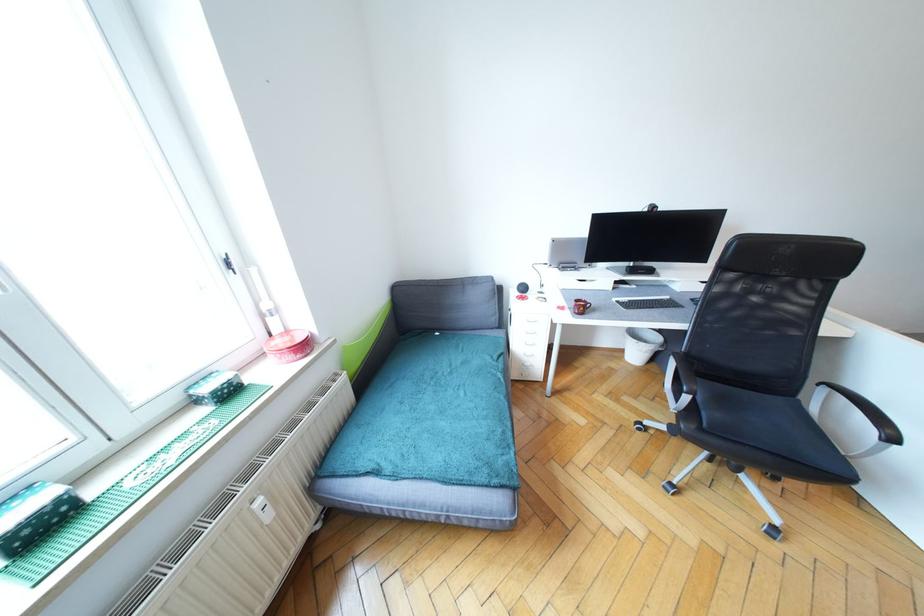
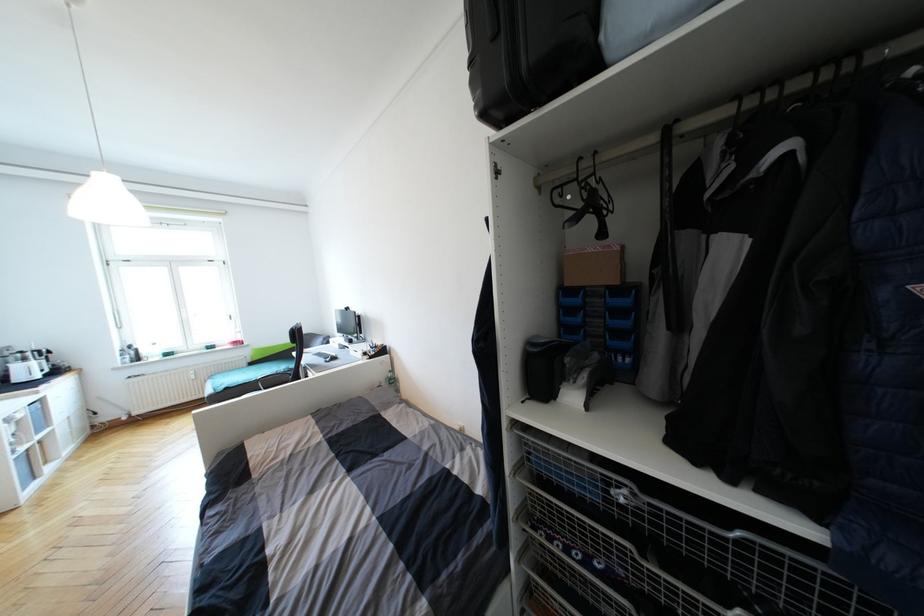
In the second image, find the point that corresponds to (x=45, y=530) in the first image.

(171, 357)